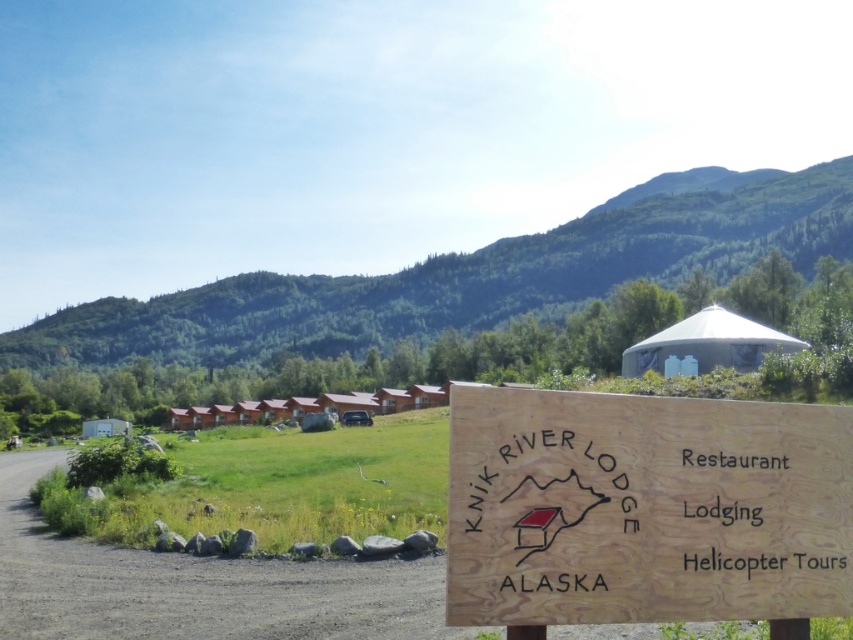
Which is below, wooden sign at center or green forested mountain at upper center?

wooden sign at center is lower down.

Describe the element at coordinates (643, 508) in the screenshot. I see `wooden sign at center` at that location.

The width and height of the screenshot is (853, 640). Find the location of `wooden sign at center`. wooden sign at center is located at coordinates (643, 508).